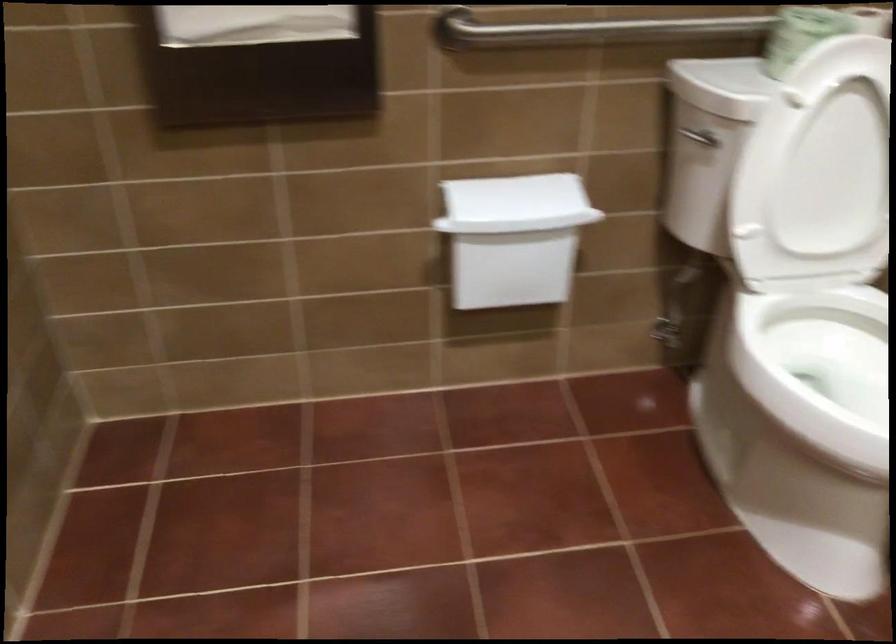
You are a GUI agent. You are given a task and a screenshot of the screen. Output one action in this format:
    pyautogui.click(x=<x>, y=<y>)
    Task: Click on the toilet flush handle
    
    Given the screenshot: What is the action you would take?
    pyautogui.click(x=700, y=136)